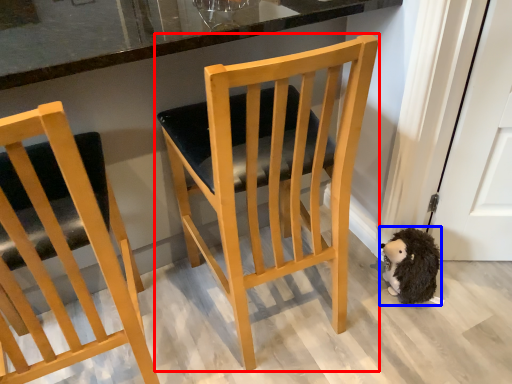
Question: Which object is further to the camera taking this photo, chair (highlighted by a red box) or animal (highlighted by a blue box)?

Choices:
 (A) chair
 (B) animal

Answer: (B)